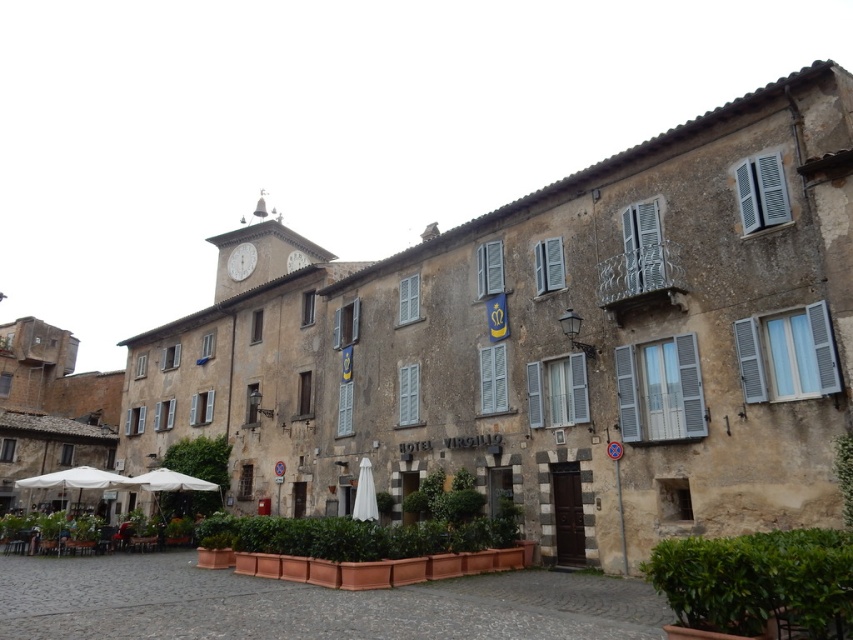
Question: Can you confirm if white fabric umbrella at center is positioned below white stone clock at upper center?

Choices:
 (A) no
 (B) yes

Answer: (B)

Question: Which point is farther to the camera?

Choices:
 (A) white stone clock at upper center
 (B) white fabric umbrella at center

Answer: (A)

Question: Can you confirm if white fabric umbrella at center is wider than white stone clock at upper center?

Choices:
 (A) no
 (B) yes

Answer: (A)

Question: Is white fabric umbrella at center to the left of white stone clock at upper center from the viewer's perspective?

Choices:
 (A) yes
 (B) no

Answer: (B)